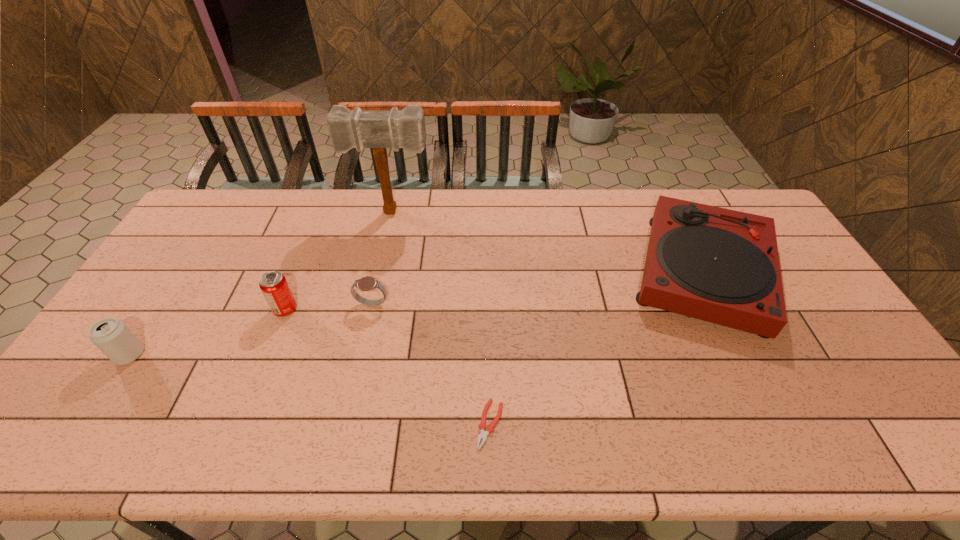
Where is `free space at the left edge`? The height and width of the screenshot is (540, 960). free space at the left edge is located at coordinates (180, 312).

The image size is (960, 540). Find the location of `vacant space at the right edge of the desktop`. vacant space at the right edge of the desktop is located at coordinates (804, 325).

Locate an element on the screen. The width and height of the screenshot is (960, 540). vacant point at the far right corner is located at coordinates (753, 199).

The height and width of the screenshot is (540, 960). In order to click on free area in between the can and the rightmost object in this screenshot , I will do `click(417, 313)`.

Identify the location of empty location between the watch and the tallest object. (382, 258).

Image resolution: width=960 pixels, height=540 pixels. Identify the location of free spot between the can and the pliers. click(x=310, y=390).

Locate an element on the screen. The image size is (960, 540). vacant area that lies between the watch and the nearest object is located at coordinates (x=431, y=364).

What are the coordinates of `free area in between the tallest object and the soda can` in the screenshot? It's located at (339, 261).

The image size is (960, 540). What are the coordinates of `vacant area that lies between the fifth object from right to left and the record player` in the screenshot? It's located at (494, 291).

Identify the location of free space that is in between the tallest object and the watch. Image resolution: width=960 pixels, height=540 pixels. (382, 258).